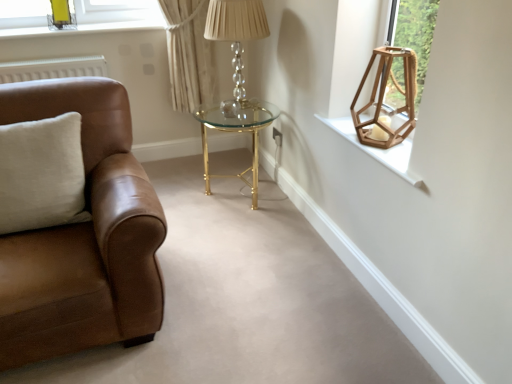
What are the coordinates of `free space that is to the left of metallic gold lamp at upper left, arranged as the second lamp when viewed from the right` in the screenshot? It's located at (36, 26).